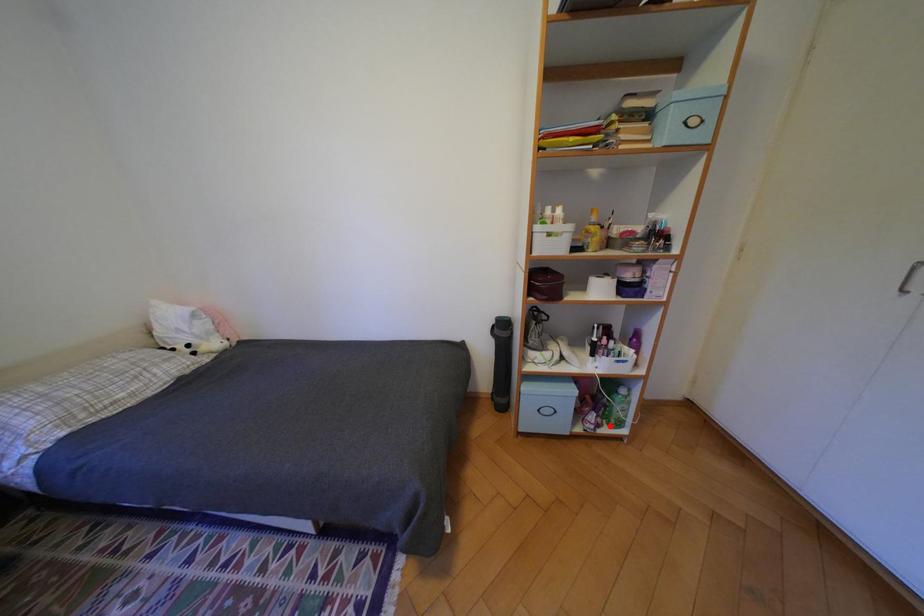
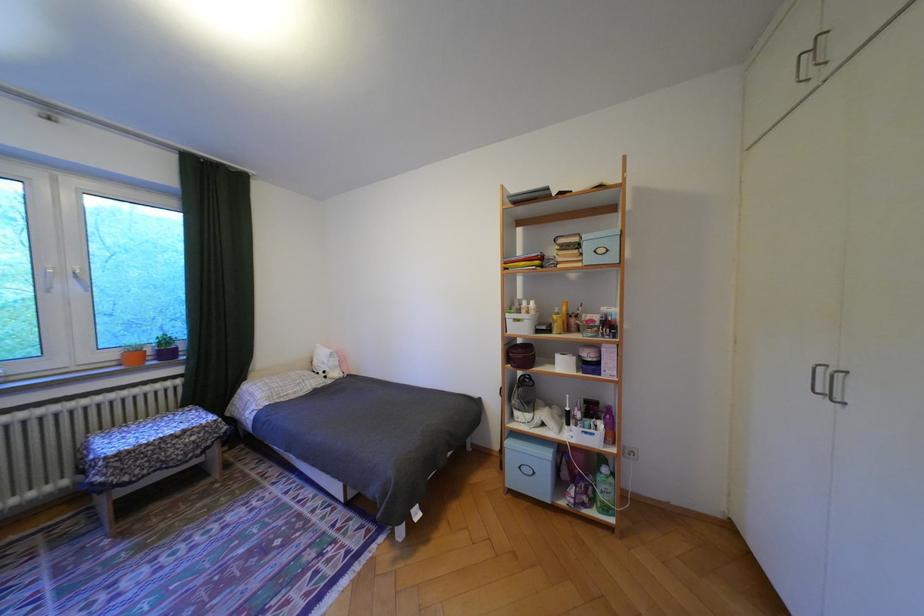
The point at the highlighted location is marked in the first image. Where is the corresponding point in the second image?

(596, 505)